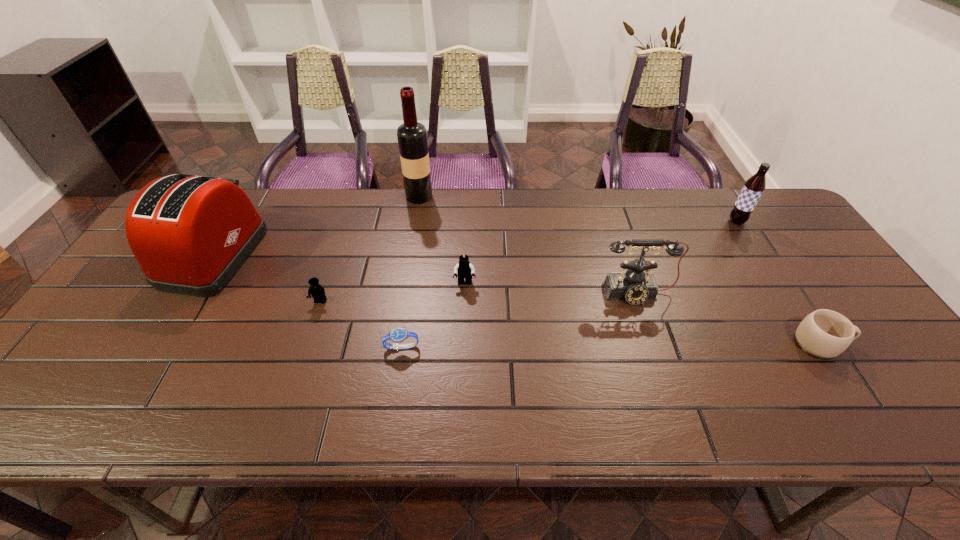
Image resolution: width=960 pixels, height=540 pixels. In order to click on vacant space at the near left corner in this screenshot , I will do `click(80, 402)`.

The height and width of the screenshot is (540, 960). I want to click on empty space between the toaster and the mug, so tap(518, 299).

The width and height of the screenshot is (960, 540). Find the location of `blank region between the watch and the fifth tallest object`. blank region between the watch and the fifth tallest object is located at coordinates (433, 315).

What are the coordinates of `blank region between the toaster and the mug` in the screenshot? It's located at (518, 299).

The width and height of the screenshot is (960, 540). Find the location of `empty space that is in between the mug and the second object from left to right`. empty space that is in between the mug and the second object from left to right is located at coordinates (571, 322).

This screenshot has height=540, width=960. What are the coordinates of `free point between the shorter Lego and the shortest object` in the screenshot? It's located at (361, 325).

Where is `free space between the second object from left to right and the toaster`? free space between the second object from left to right and the toaster is located at coordinates (268, 278).

The image size is (960, 540). What are the coordinates of `empty space between the mug and the third object from right to left` in the screenshot? It's located at coord(729,319).

Locate an element on the screen. The width and height of the screenshot is (960, 540). free space that is in between the left Lego and the watch is located at coordinates (x=361, y=325).

You are a GUI agent. You are given a task and a screenshot of the screen. Output one action in this format:
    pyautogui.click(x=<x>, y=<y>)
    Task: Click on the vacant space in between the fourth object from right to left and the leftmost object
    
    Given the screenshot: What is the action you would take?
    pyautogui.click(x=340, y=269)